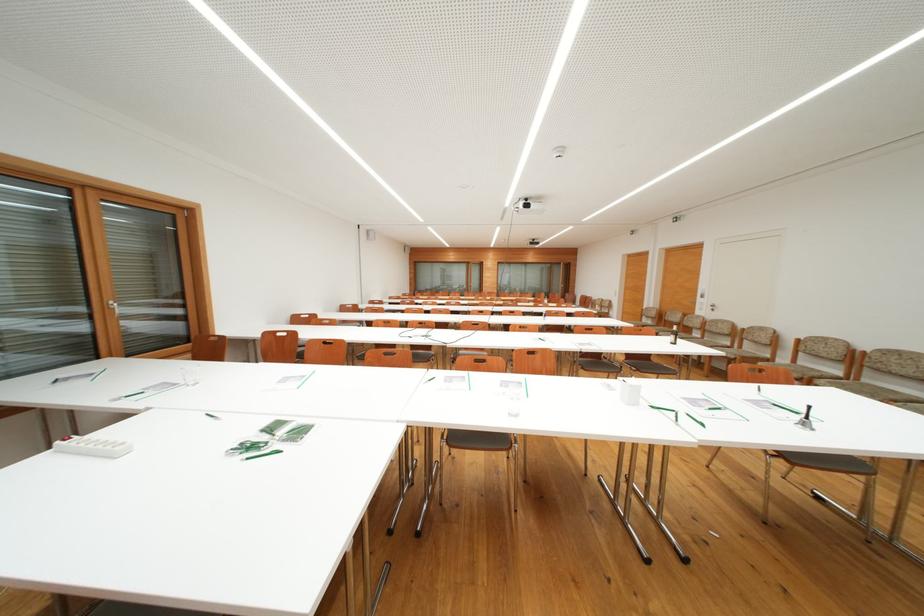
Describe the element at coordinates (91, 447) in the screenshot. The image size is (924, 616). I see `the white power strip` at that location.